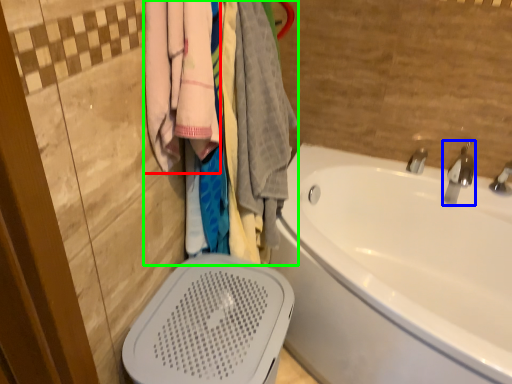
Question: Which object is the closest to the clothing (highlighted by a red box)? Choose among these: tap (highlighted by a blue box) or closet (highlighted by a green box).

Choices:
 (A) tap
 (B) closet

Answer: (B)